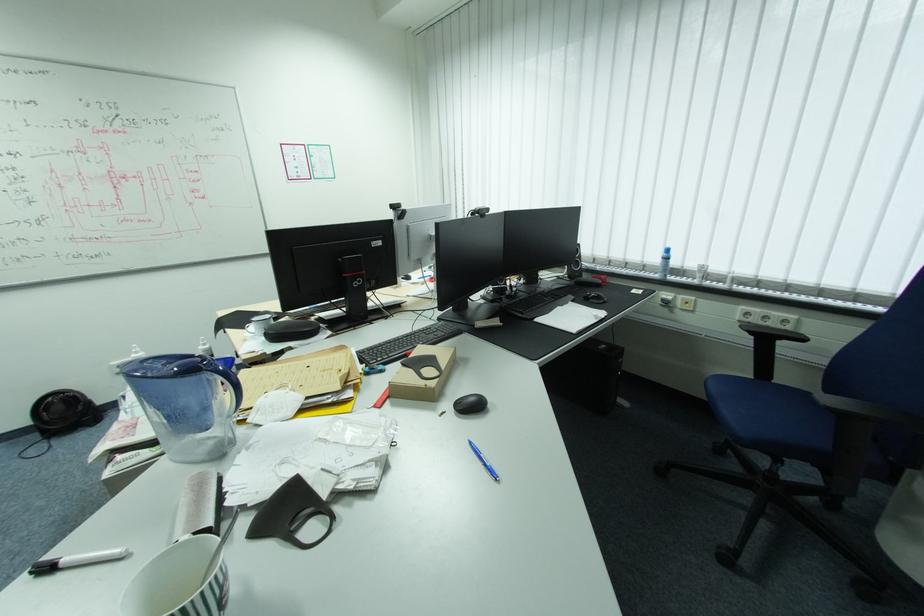
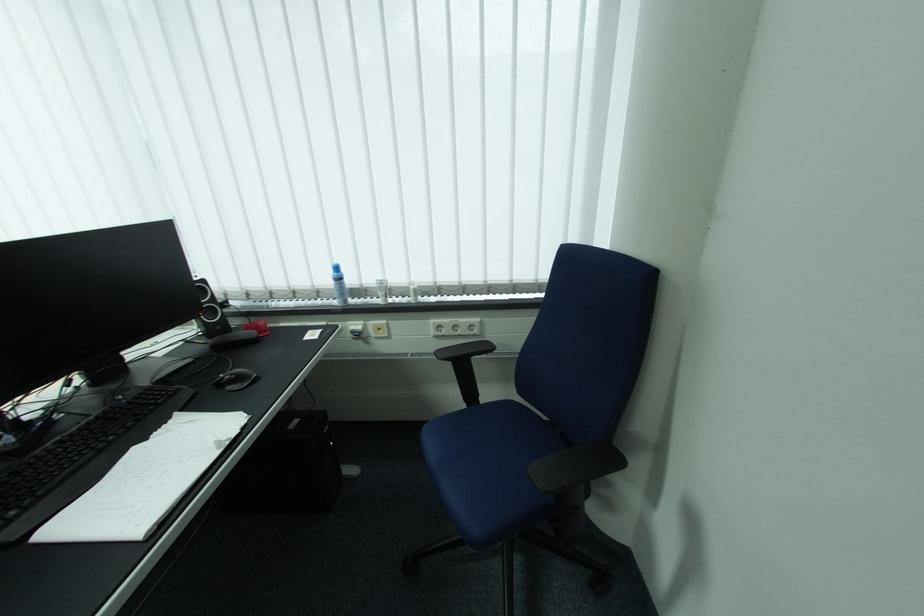
In the second image, find the point that corresponds to the point at 699,264 in the first image.

(377, 281)